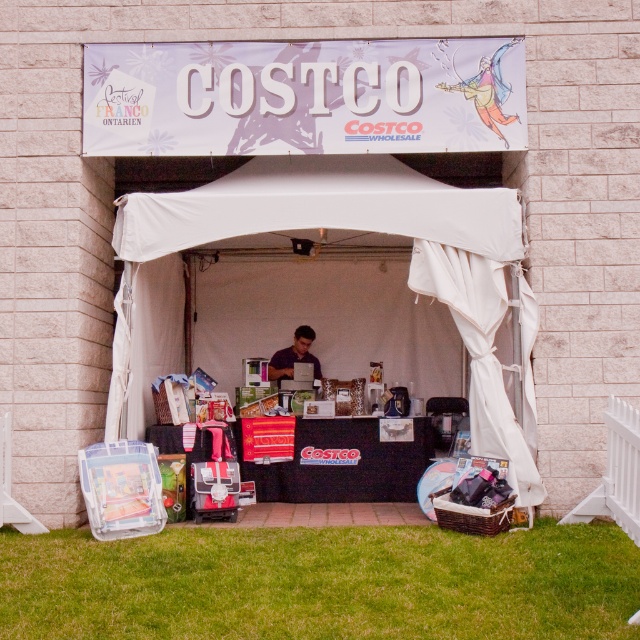
You are standing at the edge of the promotional booth and want to step onto the green grass at lower center. Which direction should you move relative to the white fabric tent at center?

The green grass at lower center is to the left of the white fabric tent at center, so you should move towards the left side of the white fabric tent at center to reach it.

You are standing at the entrance of the Costco booth and want to pick up an item from the counter. Which point, point [532,588] or point [314,332], is closer to you?

Point [532,588] is in front of point [314,332], so it is closer to you.

You are setting up a booth for an event and need to place a matte black laptop at center on the counter. However, there is already a white fabric tent at center occupying the space. Can the laptop be placed there without removing the tent?

The white fabric tent at center is larger in size than the matte black laptop at center, so there might not be enough space to place the laptop there without moving the tent.